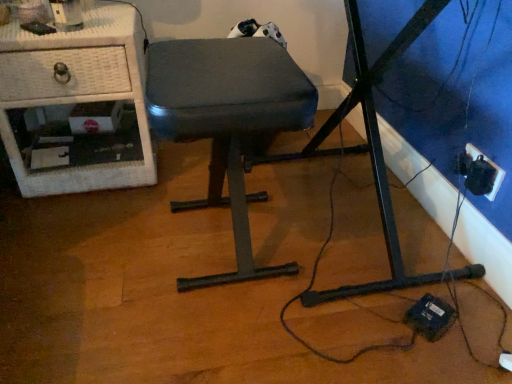
Question: Is black plastic outlet at lower right taller or shorter than white wicker nightstand at left?

Choices:
 (A) short
 (B) tall

Answer: (A)

Question: Visually, is black plastic outlet at lower right positioned to the left or to the right of white wicker nightstand at left?

Choices:
 (A) right
 (B) left

Answer: (A)

Question: Considering the real-world distances, which object is closest to the dark gray fabric stool at center?

Choices:
 (A) white wicker nightstand at left
 (B) black plastic outlet at lower right

Answer: (A)

Question: Estimate the real-world distances between objects in this image. Which object is farther from the white wicker nightstand at left?

Choices:
 (A) dark gray fabric stool at center
 (B) black plastic outlet at lower right

Answer: (B)